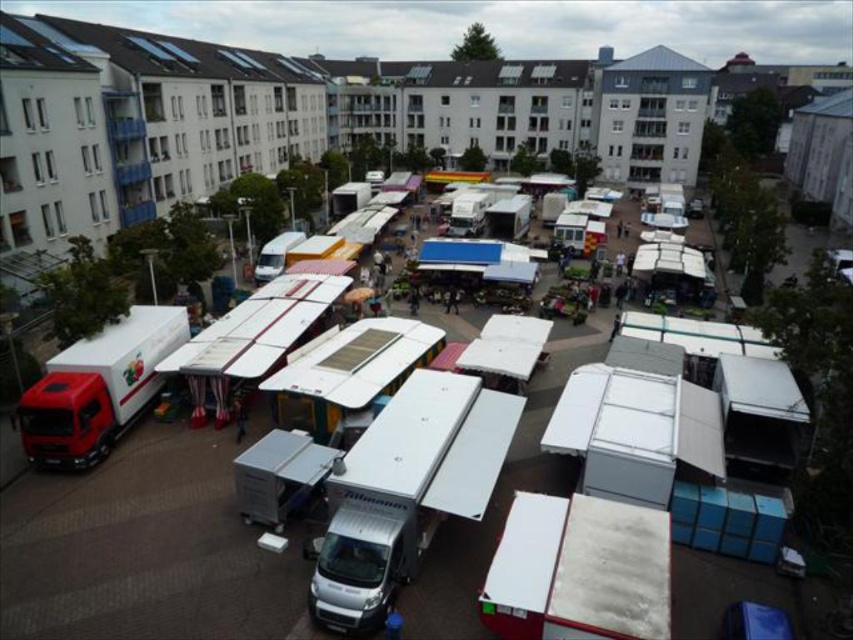
Consider the image. Which is more to the right, red matte truck at left or white matte van at center?

white matte van at center is more to the right.

Can you confirm if red matte truck at left is wider than white matte van at center?

Indeed, red matte truck at left has a greater width compared to white matte van at center.

This screenshot has width=853, height=640. What are the coordinates of `red matte truck at left` in the screenshot? It's located at (97, 387).

Locate an element on the screen. red matte truck at left is located at coordinates (97, 387).